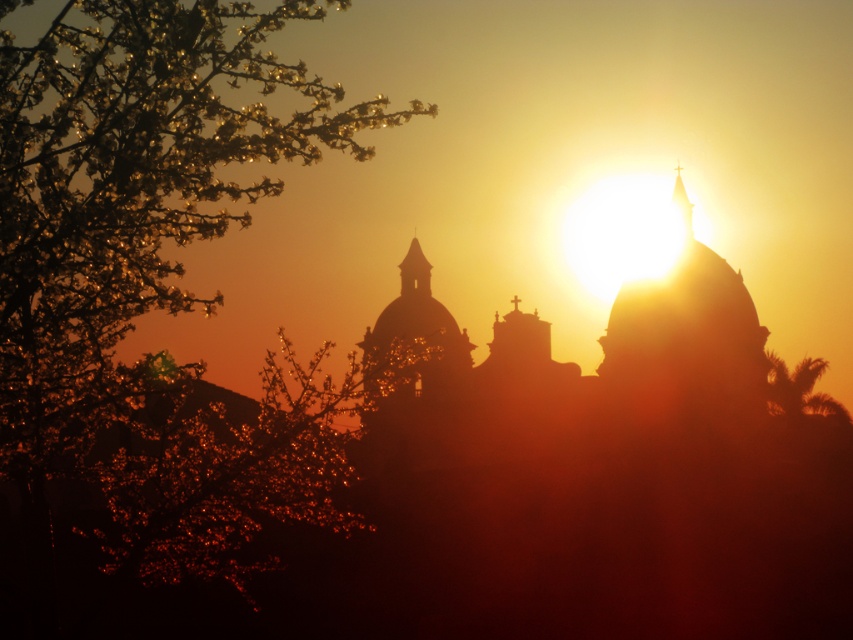
You are standing in the serene sunset scene described. You want to take a photo of the historic building with the green leafy palm at right in the background. Given that the palm is 132.52 meters away from you, will it appear small in the photo?

The green leafy palm at right is 132.52 meters away from the viewer, so it will appear small in the photo due to its distance from the camera.

You are standing in the sunset scene and want to take a photo of the transparent glass spire at upper center without the green leafy palm at right blocking it. Which direction should you move to ensure the palm is out of the frame?

Move away from the green leafy palm at right so that the transparent glass spire at upper center becomes more prominent in the frame, as the palm is closer to you and moving back will reduce its obstruction.

You are an architect analyzing the sunset scene. You notice two spires in the image. Which one is taller between the matte gold spire at center and the transparent glass spire at upper center?

The transparent glass spire at upper center is taller than the matte gold spire at center.